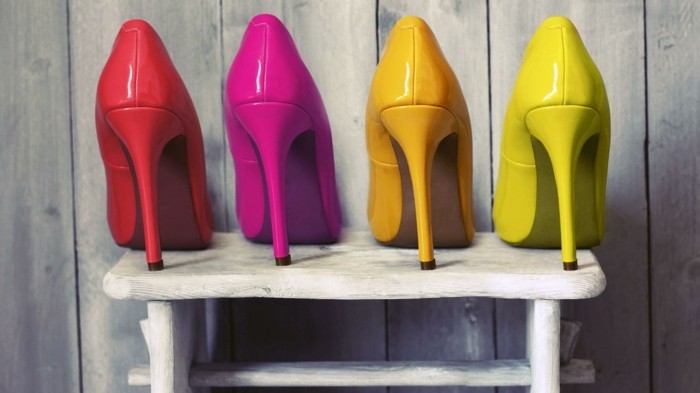
Identify the location of wood plank wall. The width and height of the screenshot is (700, 393). pyautogui.click(x=35, y=63), pyautogui.click(x=180, y=29), pyautogui.click(x=354, y=13), pyautogui.click(x=470, y=9), pyautogui.click(x=512, y=10), pyautogui.click(x=682, y=45).